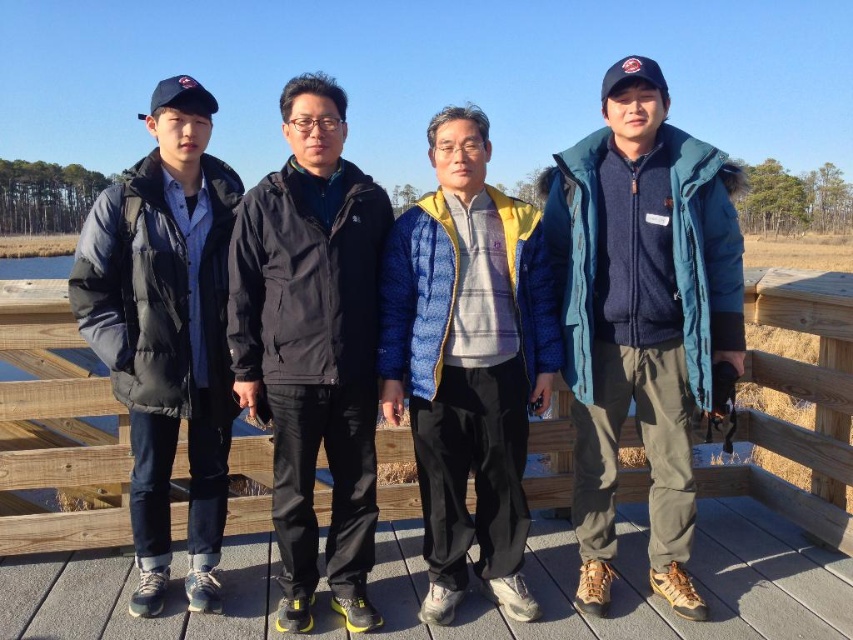
You are standing on the wooden deck and want to walk from point (482, 518) to point (207, 401). Which direction should you move to get closer to the second point?

You should move away from the viewer because point (482, 518) is further to the viewer than point (207, 401). Moving away from the viewer will bring you closer to the second point.

You are planning to take a group photo of the two people wearing the blue down jacket at center and the black matte jacket at center. Which of the two should stand on the sides to balance the group photo composition?

The blue down jacket at center should stand on the sides because it has a greater width than the black matte jacket at center, so placing the wider individual on the sides can help balance the composition.